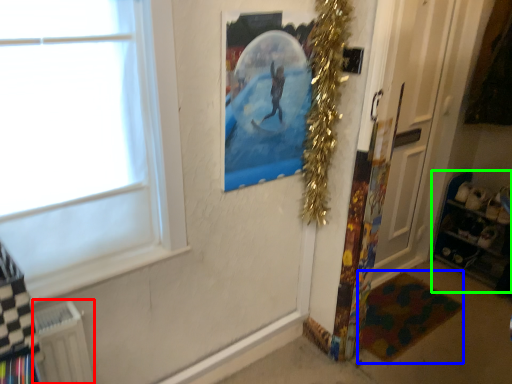
Question: Which object is positioned farthest from radiator (highlighted by a red box)? Select from mat (highlighted by a blue box) and shelf (highlighted by a green box).

Choices:
 (A) mat
 (B) shelf

Answer: (B)